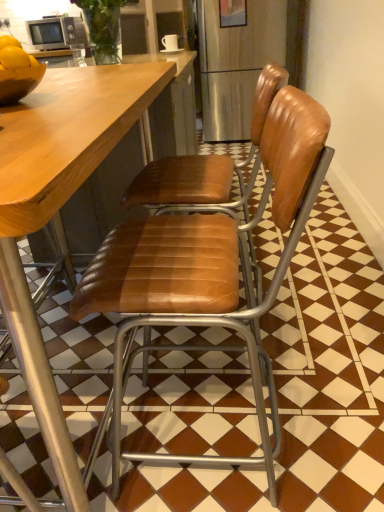
You are a GUI agent. You are given a task and a screenshot of the screen. Output one action in this format:
    pyautogui.click(x=<x>, y=<y>)
    Task: Click on the vacant location below brown leather chair at center, which ranks as the 1th chair in front-to-back order (from a real-world perspective)
    
    Given the screenshot: What is the action you would take?
    pyautogui.click(x=207, y=435)